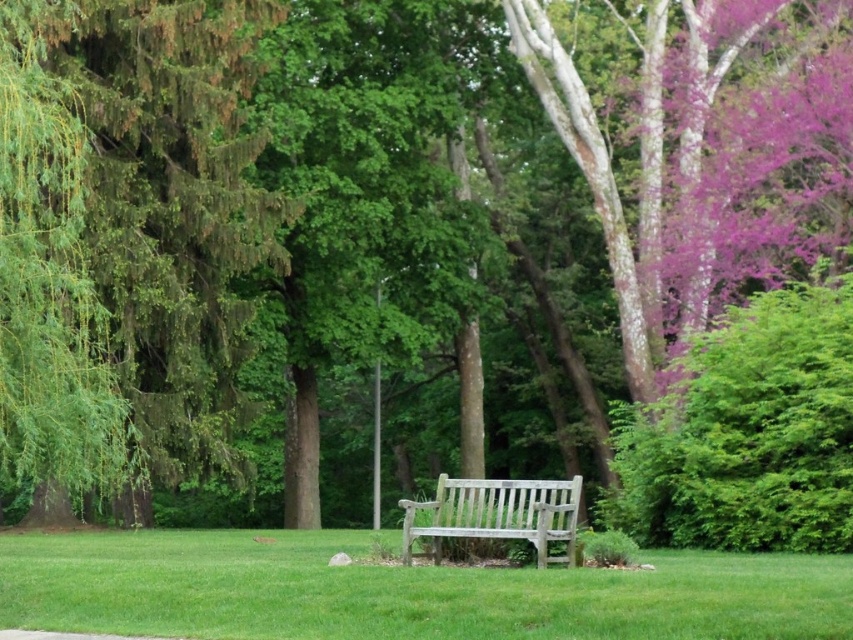
Is green leafy tree at left above wooden bench at center?

Correct, green leafy tree at left is located above wooden bench at center.

Is green leafy tree at left further to camera compared to wooden bench at center?

Yes, it is behind wooden bench at center.

Find the location of `green leafy tree at left`. green leafy tree at left is located at coordinates (125, 240).

This screenshot has width=853, height=640. Find the location of `green leafy tree at left`. green leafy tree at left is located at coordinates (125, 240).

Does green grass at center lie in front of wooden bench at center?

Yes.

Locate an element on the screen. green grass at center is located at coordinates (402, 592).

Measure the distance between green leafy tree at left and green grass at center.

green leafy tree at left and green grass at center are 3.21 meters apart.

Is green leafy tree at left below green grass at center?

Actually, green leafy tree at left is above green grass at center.

Find the location of a particular element. The width and height of the screenshot is (853, 640). green leafy tree at left is located at coordinates (125, 240).